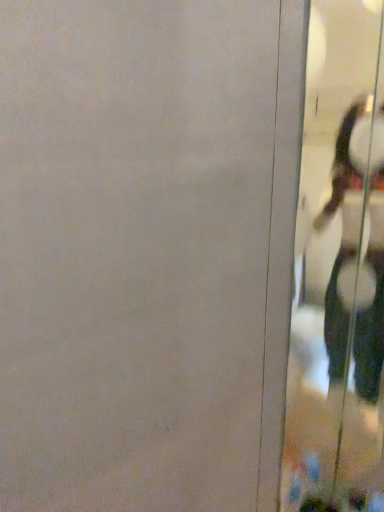
Question: Considering the relative positions of white glossy shoes at right and transparent glass screen door at right in the image provided, is white glossy shoes at right behind transparent glass screen door at right?

Choices:
 (A) no
 (B) yes

Answer: (B)

Question: Is white glossy shoes at right outside transparent glass screen door at right?

Choices:
 (A) no
 (B) yes

Answer: (B)

Question: Can you confirm if white glossy shoes at right is smaller than transparent glass screen door at right?

Choices:
 (A) no
 (B) yes

Answer: (B)

Question: Does white glossy shoes at right touch transparent glass screen door at right?

Choices:
 (A) no
 (B) yes

Answer: (A)

Question: Considering the relative sizes of white glossy shoes at right and transparent glass screen door at right in the image provided, is white glossy shoes at right shorter than transparent glass screen door at right?

Choices:
 (A) yes
 (B) no

Answer: (A)

Question: From a real-world perspective, is white glossy shoes at right on transparent glass screen door at right?

Choices:
 (A) no
 (B) yes

Answer: (A)

Question: Can you confirm if transparent glass screen door at right is positioned to the left of white glossy shoes at right?

Choices:
 (A) no
 (B) yes

Answer: (B)

Question: Can you confirm if transparent glass screen door at right is positioned to the right of white glossy shoes at right?

Choices:
 (A) yes
 (B) no

Answer: (B)

Question: Does transparent glass screen door at right have a lesser height compared to white glossy shoes at right?

Choices:
 (A) yes
 (B) no

Answer: (B)

Question: Is transparent glass screen door at right in contact with white glossy shoes at right?

Choices:
 (A) no
 (B) yes

Answer: (A)

Question: Is transparent glass screen door at right further to the viewer compared to white glossy shoes at right?

Choices:
 (A) yes
 (B) no

Answer: (B)

Question: Is transparent glass screen door at right thinner than white glossy shoes at right?

Choices:
 (A) yes
 (B) no

Answer: (A)

Question: In terms of width, does white glossy shoes at right look wider or thinner when compared to transparent glass screen door at right?

Choices:
 (A) wide
 (B) thin

Answer: (A)